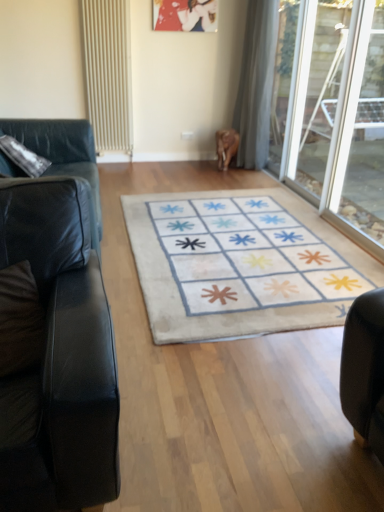
The width and height of the screenshot is (384, 512). What are the coordinates of `vacant area that is situated to the right of beige textured radiator at upper left` in the screenshot? It's located at (140, 164).